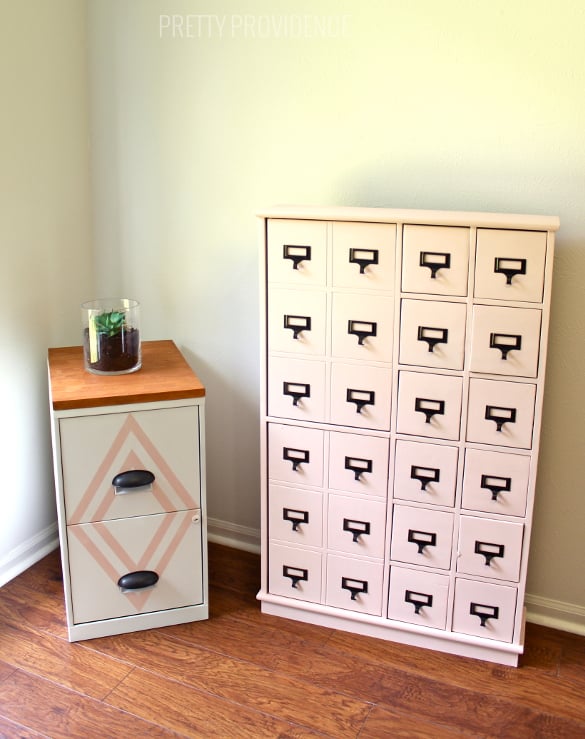
At what (x,y) coordinates should I click in order to perform the action: click on handle on small cabinet. Please return your answer as a coordinate pair (x, y). Image resolution: width=585 pixels, height=739 pixels. Looking at the image, I should click on click(x=136, y=474), click(x=139, y=567).